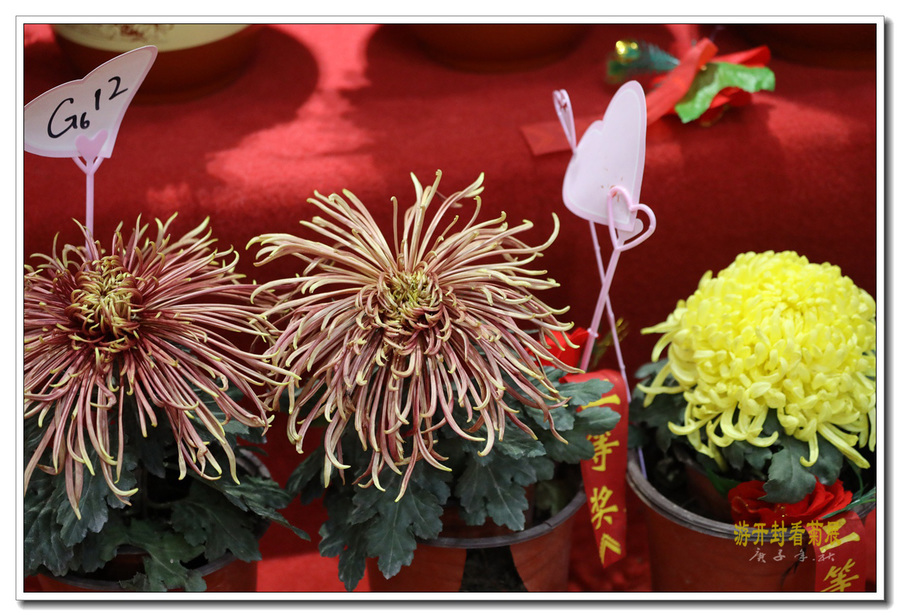
At what (x,y) coordinates should I click in order to perform the action: click on white card holders with heart on top that is stuck inside planter with a card inside the heart part of it. Please return your answer as a coordinate pair (x, y). The image size is (900, 616). Looking at the image, I should click on (617, 238), (91, 179), (564, 108).